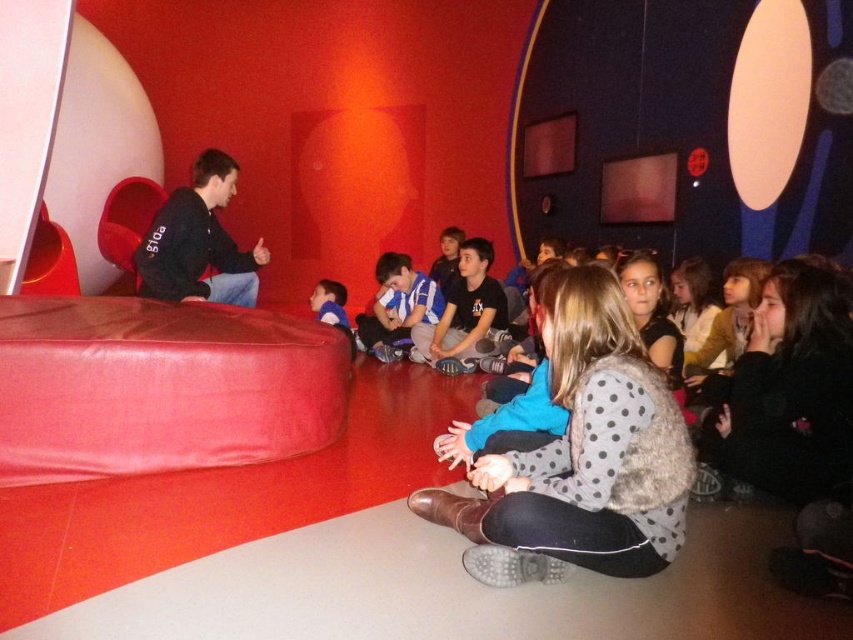
You are organizing a clothing donation drive and need to pack these two sweaters into a small box. Based on the image, which sweater, the polka dot sweater at center or the matte black sweater at left, would you choose to place first into the box to ensure both fit?

The polka dot sweater at center occupies less space than the matte black sweater at left, so you should place the matte black sweater at left first to ensure both fit in the box.

You are a child trying to sit comfortably between the smooth red bean bag at left and the polka dot sweater at center. Which object is wider so you can choose the wider one to sit on?

The smooth red bean bag at left is wider than the polka dot sweater at center, so you should choose the smooth red bean bag at left to sit on for more comfort.